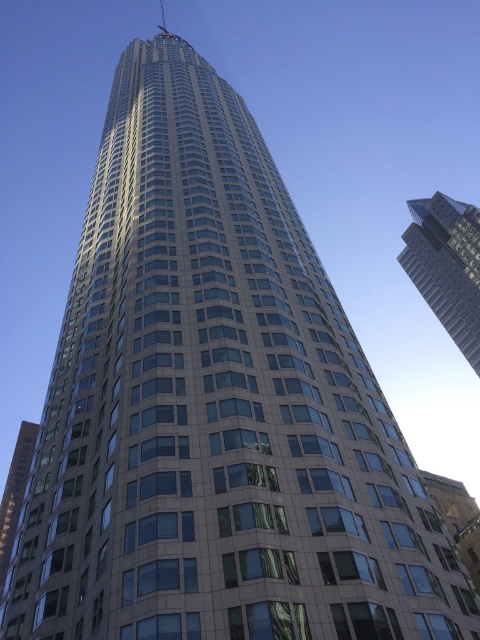
Question: Does glassy reflective skyscraper at upper right have a larger size compared to glassy reflective building at lower left?

Choices:
 (A) no
 (B) yes

Answer: (A)

Question: Is glassy reflective skyscraper at upper right positioned behind glassy reflective building at lower left?

Choices:
 (A) no
 (B) yes

Answer: (B)

Question: Does glassy reflective skyscraper at upper right come behind glassy reflective building at lower left?

Choices:
 (A) yes
 (B) no

Answer: (A)

Question: Which point is closer to the camera?

Choices:
 (A) (447, 220)
 (B) (17, 483)

Answer: (B)

Question: Which point is closer to the camera?

Choices:
 (A) (1, 540)
 (B) (417, 244)

Answer: (A)